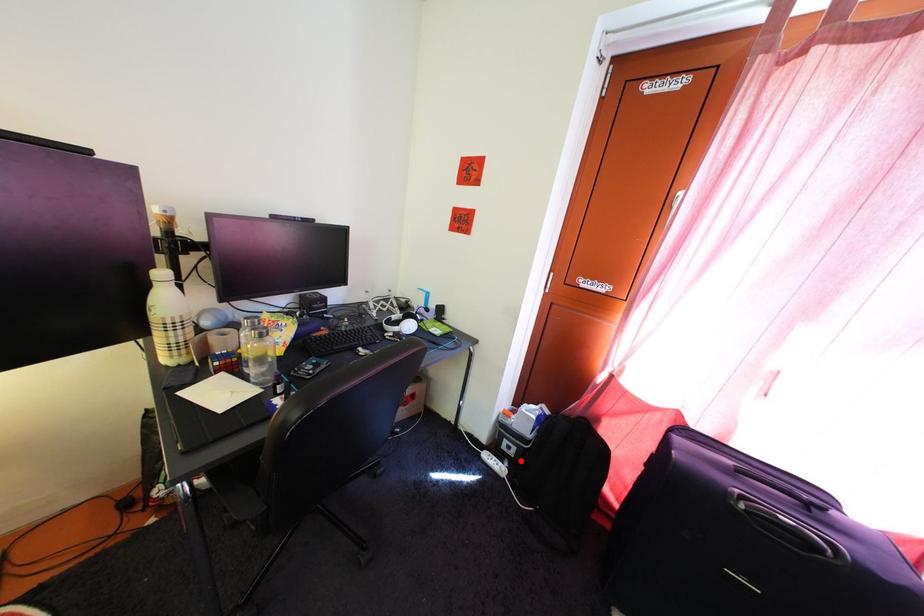
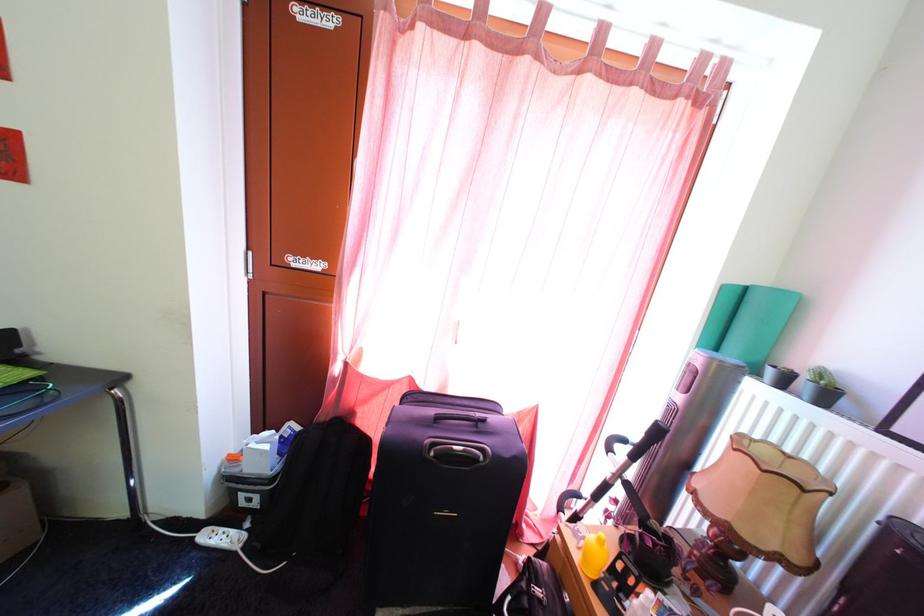
The point at the highlighted location is marked in the first image. Where is the corresponding point in the second image?

(264, 512)